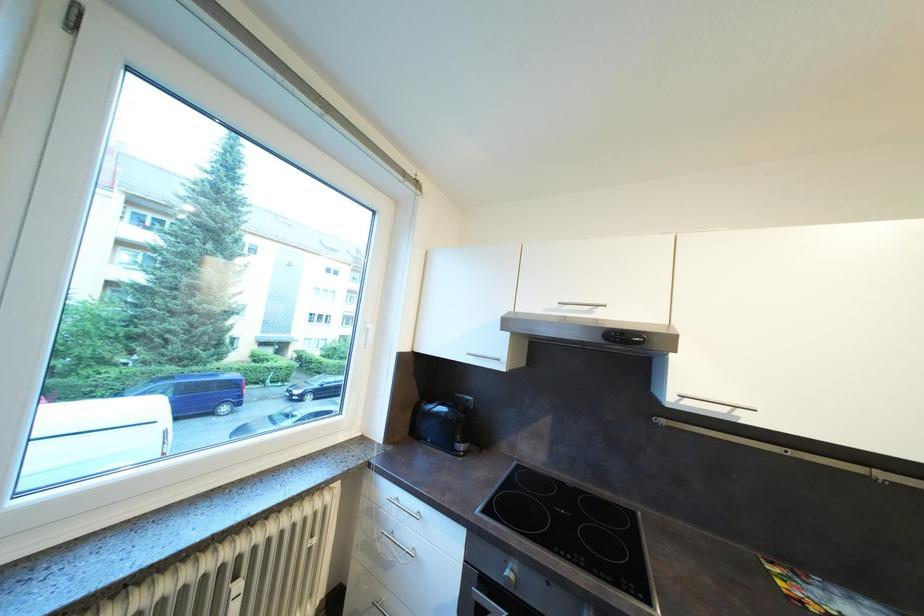
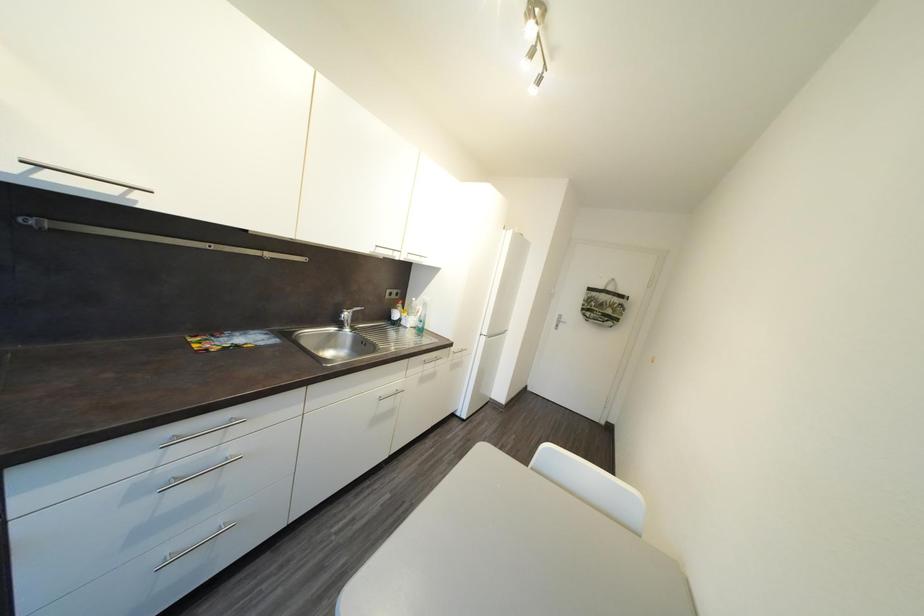
The images are taken continuously from a first-person perspective. In which direction is your viewpoint rotating?

The rotation direction of the camera is right-down.